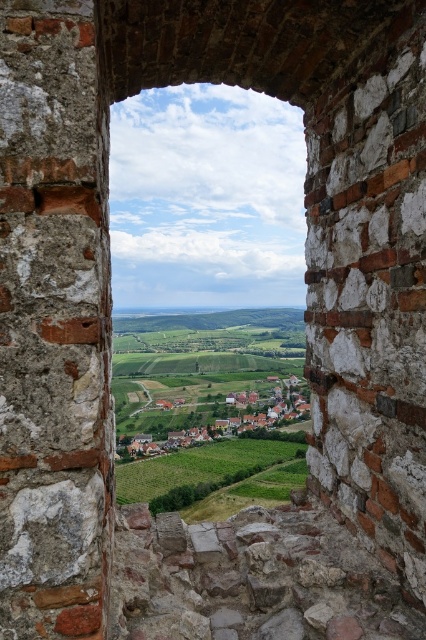
Does transparent glass window at center have a lesser width compared to green grassy field at center?

No.

Who is shorter, transparent glass window at center or green grassy field at center?

With less height is green grassy field at center.

Measure the distance between point (267, 344) and camera.

The distance of point (267, 344) from camera is 2309.31 feet.

Where is `transparent glass window at center`? transparent glass window at center is located at coordinates (204, 252).

Is point (233, 362) positioned in front of point (193, 408)?

No.

Who is more distant from viewer, (117, 356) or (140, 436)?

The point (117, 356) is more distant.

Who is more distant from viewer, (175,419) or (239,412)?

The point (239,412) is behind.

This screenshot has width=426, height=640. What are the coordinates of `green grassy field at center` in the screenshot? It's located at (210, 406).

Does transparent glass window at center have a smaller size compared to green grassy village at center?

Actually, transparent glass window at center might be larger than green grassy village at center.

Describe the element at coordinates (204, 252) in the screenshot. I see `transparent glass window at center` at that location.

From the picture: Measure the distance between point (232, 230) and camera.

Point (232, 230) and camera are 718.50 meters apart from each other.

I want to click on transparent glass window at center, so click(204, 252).